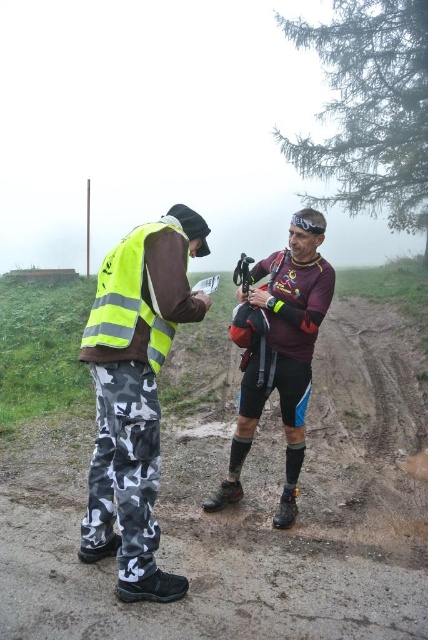
The image size is (428, 640). I want to click on maroon synthetic shirt at center, so click(279, 353).

Is maroon synthetic shirt at center smaller than yellow reflective safety vest at left?

No, maroon synthetic shirt at center is not smaller than yellow reflective safety vest at left.

The width and height of the screenshot is (428, 640). In order to click on maroon synthetic shirt at center in this screenshot , I will do `click(279, 353)`.

I want to click on maroon synthetic shirt at center, so click(279, 353).

Can you confirm if high visibility fabric vest at left is positioned below maroon synthetic shirt at center?

Yes, high visibility fabric vest at left is below maroon synthetic shirt at center.

Does high visibility fabric vest at left lie in front of maroon synthetic shirt at center?

Yes, it is in front of maroon synthetic shirt at center.

This screenshot has height=640, width=428. What are the coordinates of `high visibility fabric vest at left` in the screenshot? It's located at (136, 394).

Looking at this image, who is shorter, camouflage pants at lower left or yellow reflective safety vest at left?

With less height is yellow reflective safety vest at left.

Can you confirm if camouflage pants at lower left is smaller than yellow reflective safety vest at left?

Actually, camouflage pants at lower left might be larger than yellow reflective safety vest at left.

Is point (154, 440) positioned after point (95, 314)?

That is False.

Locate an element on the screen. The image size is (428, 640). camouflage pants at lower left is located at coordinates (124, 468).